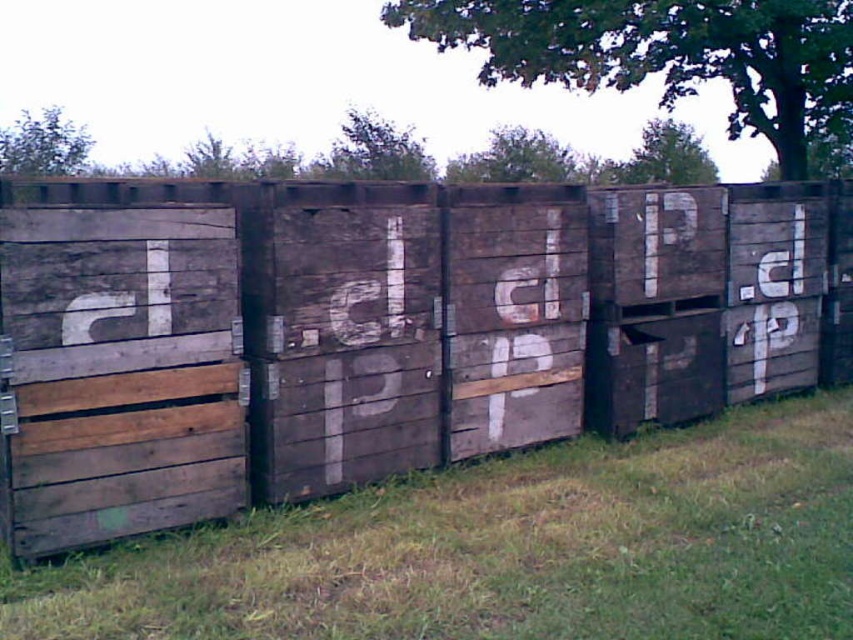
You are standing in the middle of a grassy field and see weathered wood crates at center. What is the location of the point marked as (387, 330)?

The point marked as (387, 330) indicates the location of the weathered wood crates at center.

You are standing in front of the row of wooden crates and want to reach both points. Which point, point (22, 192) or point (456, 548), will you reach first if you move towards them?

You will reach point (22, 192) first because it is closer to you than point (456, 548).